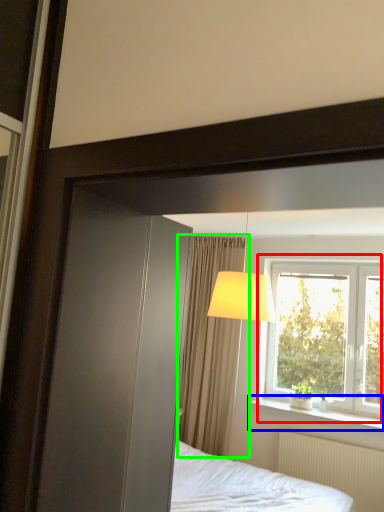
Question: Which object is the closest to the window (highlighted by a red box)? Choose among these: window sill (highlighted by a blue box) or curtain (highlighted by a green box).

Choices:
 (A) window sill
 (B) curtain

Answer: (A)